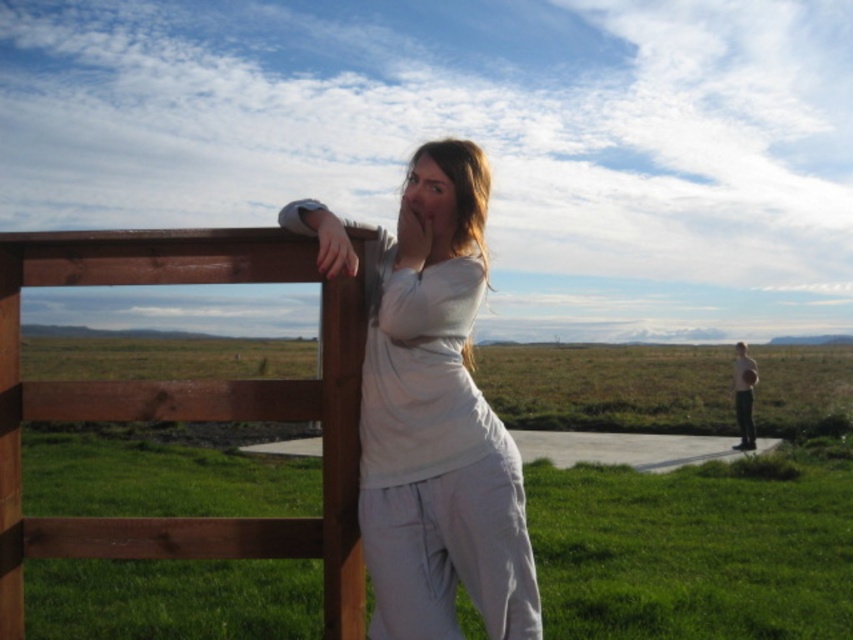
You are trying to decide which fence to climb over. The brown wooden fence at left and the light brown wooden fence at upper left are both in your path. Based on their heights, which one would be easier to climb?

The brown wooden fence at left is not as tall as the light brown wooden fence at upper left, so it would be easier to climb.

You are planning to install a new fence in your backyard. You have two options based on the image provided. The first option is the brown wooden fence at left, and the second is the light brown wooden fence at upper left. Which fence is larger in size?

The light brown wooden fence at upper left is larger in size compared to the brown wooden fence at left.